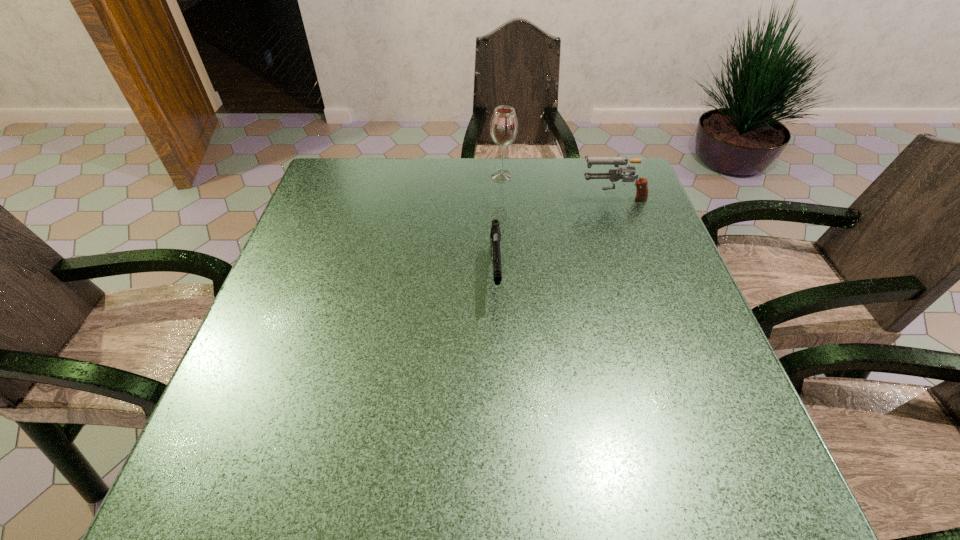
What are the coordinates of `the tallest object` in the screenshot? It's located at (504, 125).

Where is `wineglass`? wineglass is located at coordinates (504, 125).

The width and height of the screenshot is (960, 540). I want to click on the taller gun, so click(614, 175).

You are a GUI agent. You are given a task and a screenshot of the screen. Output one action in this format:
    pyautogui.click(x=<x>, y=<y>)
    Task: Click on the second nearest object
    Image resolution: width=960 pixels, height=540 pixels.
    Given the screenshot: What is the action you would take?
    [614, 175]

What are the coordinates of `the nearer gun` in the screenshot? It's located at (495, 236).

Image resolution: width=960 pixels, height=540 pixels. Find the location of `the nearest object`. the nearest object is located at coordinates (495, 236).

Image resolution: width=960 pixels, height=540 pixels. What are the coordinates of `free region located 0.230m on the right of the farthest object` in the screenshot? It's located at (593, 176).

Locate an element on the screen. Image resolution: width=960 pixels, height=540 pixels. vacant space located at the barrel end of the rightmost object is located at coordinates (543, 196).

I want to click on vacant area located 0.170m at the barrel end of the rightmost object, so click(518, 196).

The image size is (960, 540). Find the location of `vacant region located 0.240m at the barrel end of the rightmost object`. vacant region located 0.240m at the barrel end of the rightmost object is located at coordinates (492, 196).